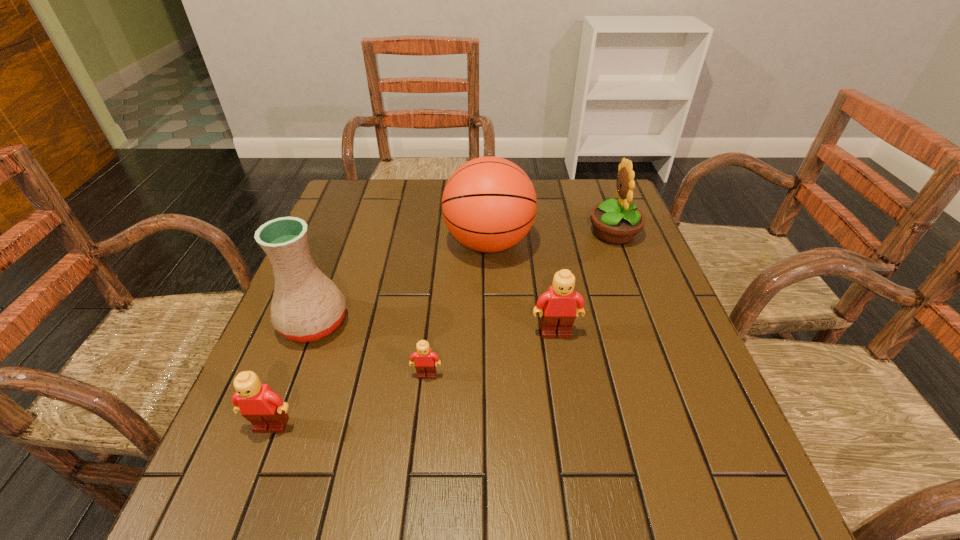
Find the location of a particular element. The width and height of the screenshot is (960, 540). object that is the second closest to the basketball is located at coordinates (559, 311).

Choose which Lego is the second nearest neighbor to the farthest Lego. Please provide its 2D coordinates. Your answer should be formatted as a tuple, i.e. [(x, y)], where the tuple contains the x and y coordinates of a point satisfying the conditions above.

[(265, 409)]

Locate which Lego ranks in proximity to the second tallest Lego. Please provide its 2D coordinates. Your answer should be formatted as a tuple, i.e. [(x, y)], where the tuple contains the x and y coordinates of a point satisfying the conditions above.

[(426, 362)]

Find the location of `vacant position in the image that satisfies the following two spatial constraints: 1. on the face of the sunflower; 2. on the face of the farthest Lego`. vacant position in the image that satisfies the following two spatial constraints: 1. on the face of the sunflower; 2. on the face of the farthest Lego is located at coordinates (652, 333).

You are a GUI agent. You are given a task and a screenshot of the screen. Output one action in this format:
    pyautogui.click(x=<x>, y=<y>)
    Task: Click on the free space that satisfies the following two spatial constraints: 1. on the face of the rightmost object; 2. on the front side of the basketball
    The image size is (960, 540).
    Given the screenshot: What is the action you would take?
    pyautogui.click(x=617, y=243)

Image resolution: width=960 pixels, height=540 pixels. In order to click on blank area in the image that satisfies the following two spatial constraints: 1. on the face of the sunflower; 2. on the face of the leftmost Lego in this screenshot , I will do `click(686, 426)`.